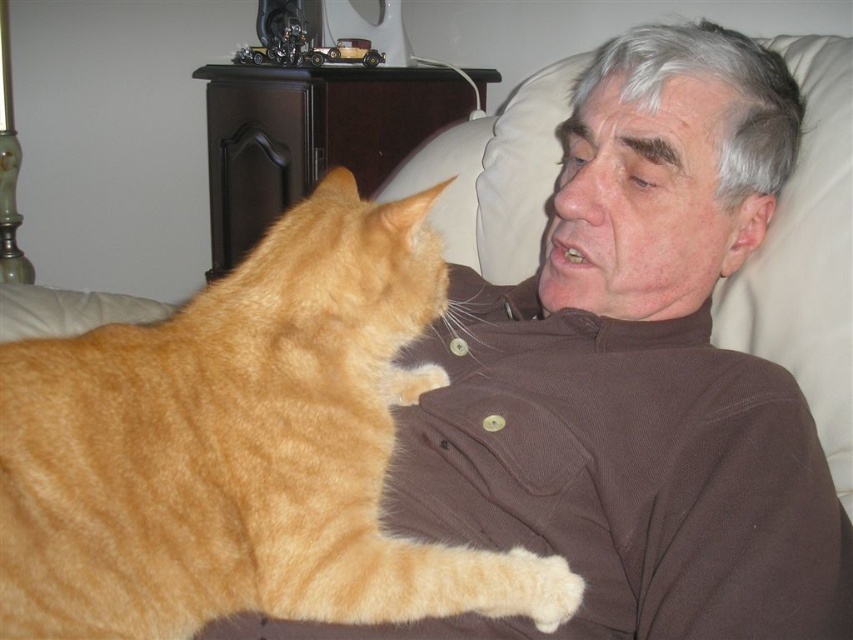
From the picture: Can you confirm if orange fur cat at upper left is bigger than white soft pillow at upper right?

Correct, orange fur cat at upper left is larger in size than white soft pillow at upper right.

Which is above, orange fur cat at upper left or white soft pillow at upper right?

white soft pillow at upper right is above.

The height and width of the screenshot is (640, 853). What do you see at coordinates (242, 449) in the screenshot? I see `orange fur cat at upper left` at bounding box center [242, 449].

Locate an element on the screen. The height and width of the screenshot is (640, 853). orange fur cat at upper left is located at coordinates (242, 449).

Which is more to the left, brown corduroy shirt at upper right or white soft pillow at upper right?

brown corduroy shirt at upper right

Consider the image. Is brown corduroy shirt at upper right below white soft pillow at upper right?

Correct, brown corduroy shirt at upper right is located below white soft pillow at upper right.

Who is more forward, (619, 308) or (825, 65)?

Point (619, 308) is more forward.

Find the location of a particular element. brown corduroy shirt at upper right is located at coordinates (630, 378).

Between brown corduroy shirt at upper right and orange fur cat at upper left, which one appears on the left side from the viewer's perspective?

orange fur cat at upper left is more to the left.

Which is behind, point (791, 104) or point (375, 435)?

The point (791, 104) is behind.

Locate an element on the screen. brown corduroy shirt at upper right is located at coordinates (630, 378).